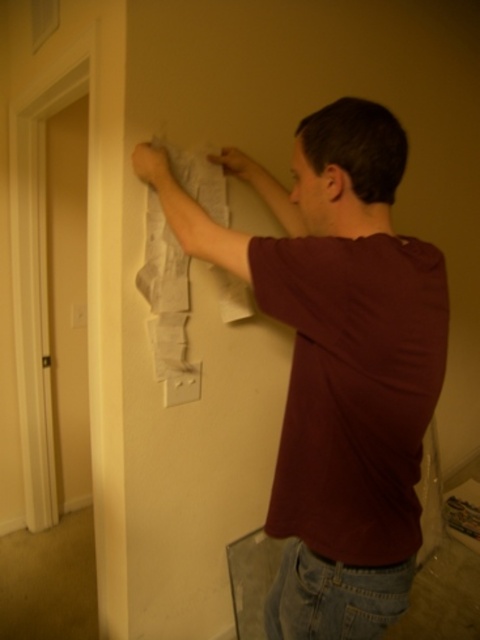
Question: Is maroon t-shirt at center thinner than white paper at upper center?

Choices:
 (A) yes
 (B) no

Answer: (B)

Question: Which point is closer to the camera?

Choices:
 (A) white paper at upper center
 (B) maroon cotton t-shirt at center
 (C) maroon t-shirt at center

Answer: (B)

Question: Which point is closer to the camera taking this photo?

Choices:
 (A) (176, 360)
 (B) (358, 337)
 (C) (317, 308)

Answer: (B)

Question: Can you confirm if maroon t-shirt at center is wider than maroon cotton t-shirt at center?

Choices:
 (A) no
 (B) yes

Answer: (B)

Question: Which object appears closest to the camera in this image?

Choices:
 (A) maroon t-shirt at center
 (B) maroon cotton t-shirt at center
 (C) white paper at upper center

Answer: (B)

Question: Does maroon t-shirt at center appear over white paper at upper center?

Choices:
 (A) no
 (B) yes

Answer: (A)